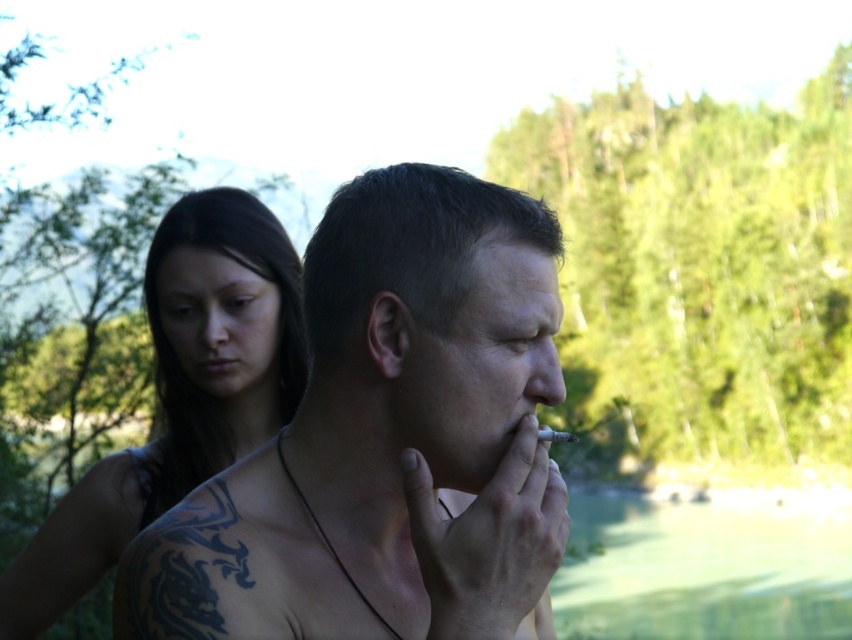
Question: Which point appears farthest from the camera in this image?

Choices:
 (A) (206, 621)
 (B) (730, 595)
 (C) (557, 435)

Answer: (B)

Question: Which of the following is the farthest from the observer?

Choices:
 (A) green liquid water at lower right
 (B) shiny metallic cigarette at center
 (C) black tattooed skin at upper left
 (D) gray matte cigarette at mouth

Answer: (A)

Question: Does green liquid water at lower right have a lesser width compared to gray matte cigarette at mouth?

Choices:
 (A) yes
 (B) no

Answer: (B)

Question: Can you confirm if black tattooed skin at upper left is positioned below green liquid water at lower right?

Choices:
 (A) yes
 (B) no

Answer: (B)

Question: Which object is positioned closest to the green liquid water at lower right?

Choices:
 (A) black tattooed skin at upper left
 (B) shiny metallic cigarette at center

Answer: (A)

Question: From the image, what is the correct spatial relationship of shiny metallic cigarette at center in relation to green liquid water at lower right?

Choices:
 (A) above
 (B) below

Answer: (A)